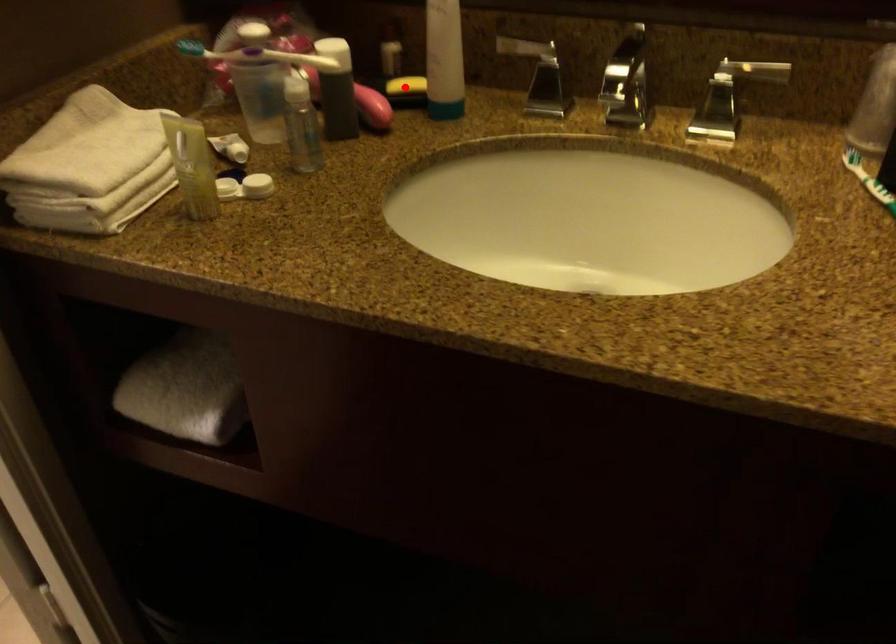
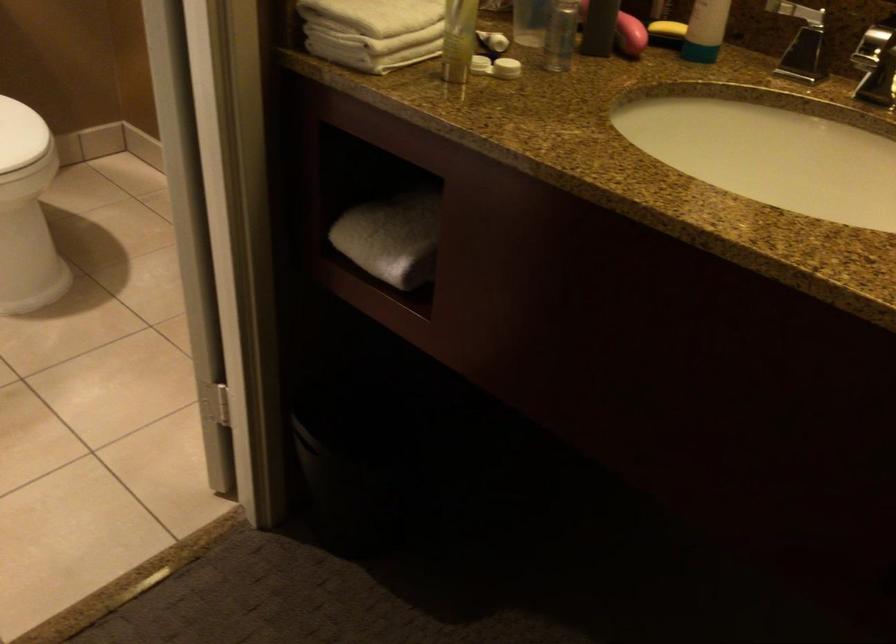
In the second image, find the point that corresponds to the highlighted location in the first image.

(667, 29)